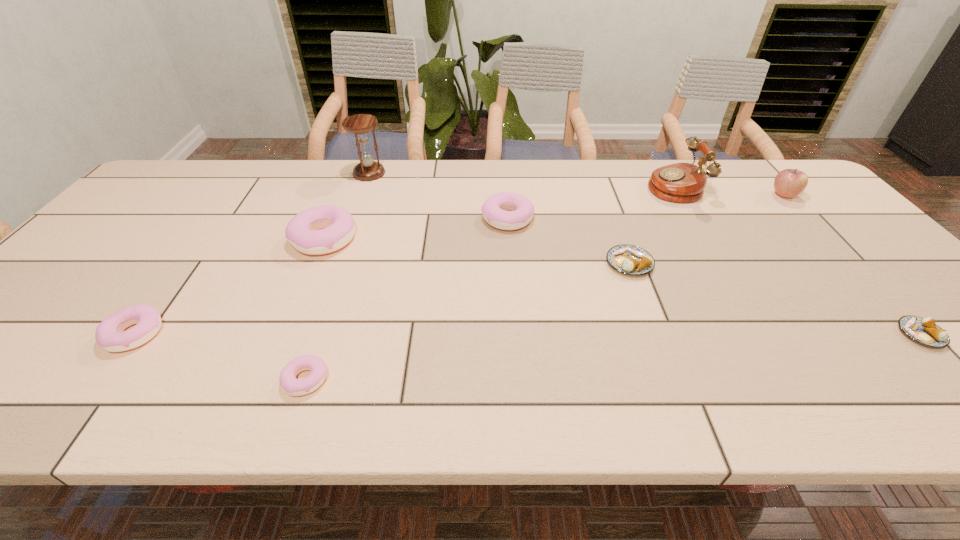
At what (x,y) coordinates should I click in order to perform the action: click on vacant region located on the left of the seventh shortest object. Please return your answer as a coordinate pair (x, y). Image resolution: width=960 pixels, height=540 pixels. Looking at the image, I should click on (658, 195).

The width and height of the screenshot is (960, 540). Identify the location of blank space located 0.260m on the back of the sixth shortest object. (351, 173).

Locate an element on the screen. vacant area located 0.200m on the back of the fifth tallest object is located at coordinates (504, 171).

Locate an element on the screen. The image size is (960, 540). vacant region located 0.140m on the back of the third biggest pink pastry is located at coordinates (180, 273).

The width and height of the screenshot is (960, 540). I want to click on vacant point located on the right of the left brown pastry, so click(x=711, y=264).

Locate an element on the screen. Image resolution: width=960 pixels, height=540 pixels. free location located on the back of the nearest pink pastry is located at coordinates (350, 248).

I want to click on free region located on the back of the rightmost pastry, so click(821, 228).

Find the location of `hourglass at the far edge`. hourglass at the far edge is located at coordinates (360, 124).

The image size is (960, 540). What are the coordinates of `telephone located in the far edge section of the desktop` in the screenshot? It's located at (681, 182).

Find the location of a particular element. The image size is (960, 540). apple at the far edge is located at coordinates (788, 183).